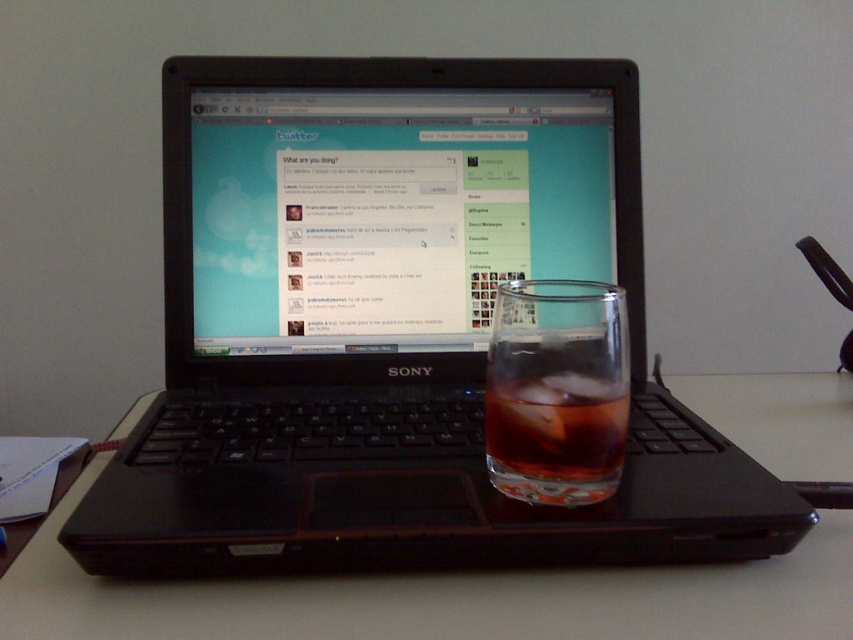
From the picture: You are trying to place a book that is 12 inches tall on the desk. The desk has the black plastic laptop at center and transparent glass at center. Which object should you move to make space for the book?

The black plastic laptop at center is taller than the transparent glass at center, so you should move the transparent glass at center to make space for the book.

You are organizing a desk and need to place the black plastic laptop at center and transparent glass at center into a drawer. The drawer has a height limit of 3 inches. Which item might not fit due to its thickness?

The transparent glass at center is thicker than the black plastic laptop at center, so it might not fit into the drawer with a 3 inch height limit.

You are organizing a small party and need to pour drinks into both the transparent glass at center and the translucent glass at laptop right. Which glass should you choose if you want to serve a larger quantity of liquid without spilling?

The translucent glass at laptop right has a greater height than the transparent glass at center, so it can hold more liquid and is better suited for serving a larger quantity without spilling.